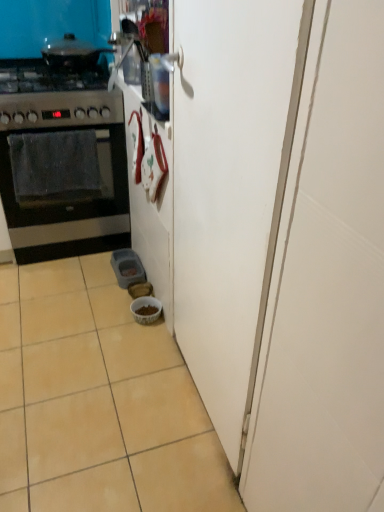
Question: Is beige ceramic tile at lower left with black matte oven at left?

Choices:
 (A) yes
 (B) no

Answer: (B)

Question: Is beige ceramic tile at lower left positioned in front of black matte oven at left?

Choices:
 (A) yes
 (B) no

Answer: (A)

Question: From a real-world perspective, is beige ceramic tile at lower left physically above black matte oven at left?

Choices:
 (A) no
 (B) yes

Answer: (A)

Question: Is beige ceramic tile at lower left to the left of black matte oven at left from the viewer's perspective?

Choices:
 (A) yes
 (B) no

Answer: (B)

Question: Does beige ceramic tile at lower left have a greater width compared to black matte oven at left?

Choices:
 (A) yes
 (B) no

Answer: (A)

Question: From the image's perspective, relative to black matte oven at left, is beige ceramic tile at lower left above or below?

Choices:
 (A) above
 (B) below

Answer: (B)

Question: Which is correct: beige ceramic tile at lower left is inside black matte oven at left, or outside of it?

Choices:
 (A) inside
 (B) outside

Answer: (B)

Question: In terms of size, does beige ceramic tile at lower left appear bigger or smaller than black matte oven at left?

Choices:
 (A) small
 (B) big

Answer: (B)

Question: Would you say beige ceramic tile at lower left is to the left or to the right of black matte oven at left in the picture?

Choices:
 (A) left
 (B) right

Answer: (B)

Question: Is shiny black pot at upper left taller or shorter than white glossy bowl at lower center?

Choices:
 (A) short
 (B) tall

Answer: (B)

Question: Is shiny black pot at upper left spatially inside white glossy bowl at lower center, or outside of it?

Choices:
 (A) inside
 (B) outside

Answer: (B)

Question: Is shiny black pot at upper left bigger or smaller than white glossy bowl at lower center?

Choices:
 (A) small
 (B) big

Answer: (B)

Question: Relative to white glossy bowl at lower center, is shiny black pot at upper left in front or behind?

Choices:
 (A) front
 (B) behind

Answer: (A)

Question: Considering their positions, is shiny black pot at upper left located in front of or behind black matte oven at left?

Choices:
 (A) behind
 (B) front

Answer: (A)

Question: Considering the positions of shiny black pot at upper left and black matte oven at left in the image, is shiny black pot at upper left bigger or smaller than black matte oven at left?

Choices:
 (A) big
 (B) small

Answer: (A)